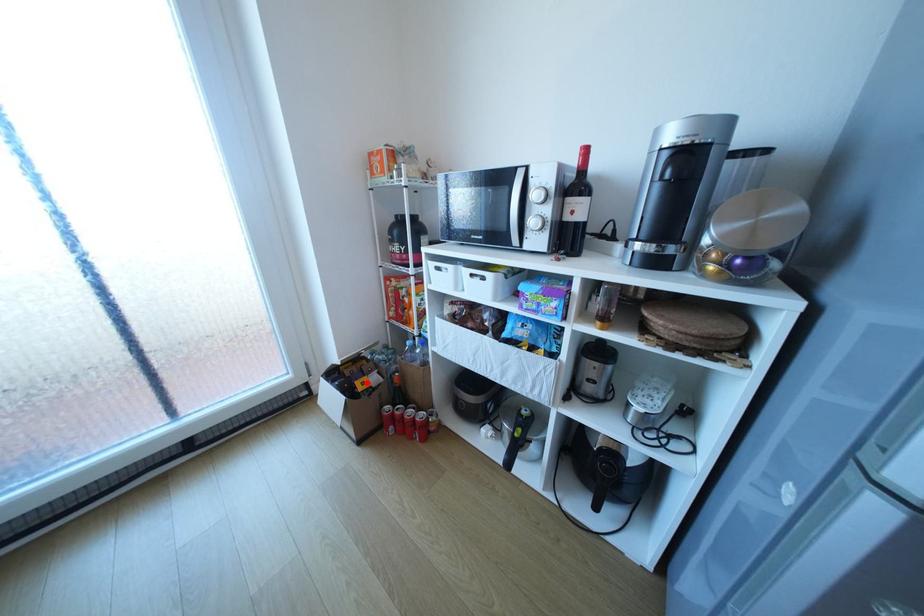
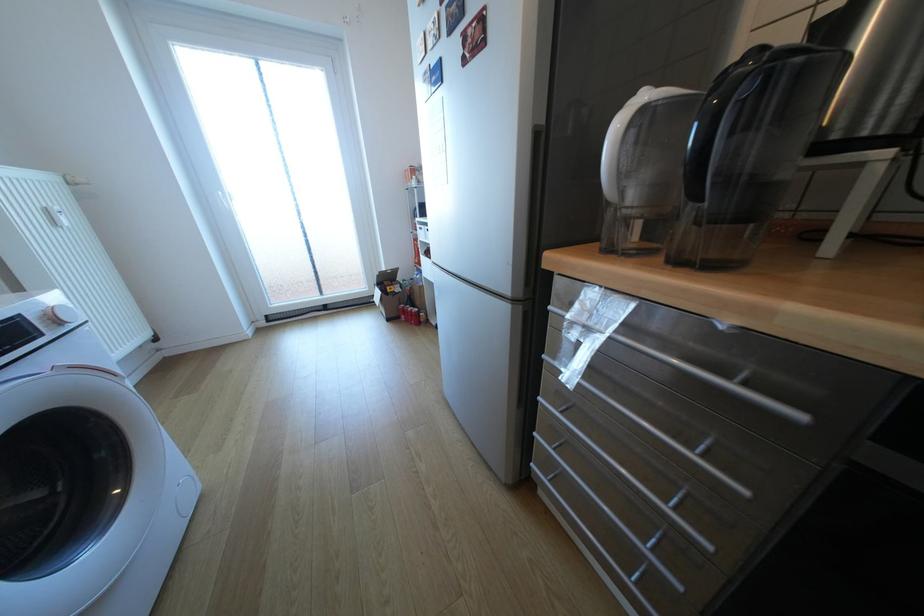
The point at the highlighted location is marked in the first image. Where is the corresponding point in the second image?

(397, 288)